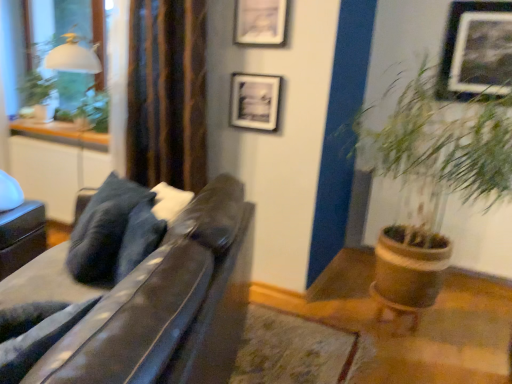
Question: Considering the relative sizes of matte black picture frame at upper center, which appears as the second picture frame when viewed from the left, and green leafy plant at right in the image provided, is matte black picture frame at upper center, which appears as the second picture frame when viewed from the left, bigger than green leafy plant at right?

Choices:
 (A) no
 (B) yes

Answer: (A)

Question: From the image's perspective, does matte black picture frame at upper center, marked as the 2th picture frame in a right-to-left arrangement, appear lower than green leafy plant at right?

Choices:
 (A) no
 (B) yes

Answer: (A)

Question: Is matte black picture frame at upper center, which appears as the second picture frame when viewed from the left, placed right next to green leafy plant at right?

Choices:
 (A) no
 (B) yes

Answer: (A)

Question: Considering the relative sizes of matte black picture frame at upper center, which appears as the second picture frame when viewed from the left, and green leafy plant at right in the image provided, is matte black picture frame at upper center, which appears as the second picture frame when viewed from the left, thinner than green leafy plant at right?

Choices:
 (A) yes
 (B) no

Answer: (A)

Question: Is matte black picture frame at upper center, which appears as the second picture frame when viewed from the left, facing away from green leafy plant at right?

Choices:
 (A) no
 (B) yes

Answer: (A)

Question: Considering the positions of matte black picture frame at upper center, marked as the 2th picture frame in a right-to-left arrangement, and green leafy plant at upper left in the image, is matte black picture frame at upper center, marked as the 2th picture frame in a right-to-left arrangement, bigger or smaller than green leafy plant at upper left?

Choices:
 (A) small
 (B) big

Answer: (A)

Question: Is point (260, 29) positioned closer to the camera than point (76, 119)?

Choices:
 (A) closer
 (B) farther

Answer: (A)

Question: Choose the correct answer: Is matte black picture frame at upper center, which appears as the second picture frame when viewed from the left, inside green leafy plant at upper left or outside it?

Choices:
 (A) inside
 (B) outside

Answer: (B)

Question: Is matte black picture frame at upper center, which appears as the second picture frame when viewed from the left, in front of or behind green leafy plant at upper left in the image?

Choices:
 (A) front
 (B) behind

Answer: (A)

Question: Relative to dark blue fabric pillow at center, is matte black picture frame at upper center, which is the 3th picture frame from right to left, in front or behind?

Choices:
 (A) behind
 (B) front

Answer: (A)

Question: Considering the relative positions of matte black picture frame at upper center, which is the 3th picture frame from right to left, and dark blue fabric pillow at center in the image provided, is matte black picture frame at upper center, which is the 3th picture frame from right to left, to the left or to the right of dark blue fabric pillow at center?

Choices:
 (A) left
 (B) right

Answer: (B)

Question: Which is correct: matte black picture frame at upper center, placed as the first picture frame when sorted from left to right, is inside dark blue fabric pillow at center, or outside of it?

Choices:
 (A) outside
 (B) inside

Answer: (A)

Question: Is point (271, 109) closer or farther from the camera than point (122, 200)?

Choices:
 (A) closer
 (B) farther

Answer: (B)

Question: From the image's perspective, is metallic silver picture frame at upper right, which is the third picture frame in left-to-right order, above or below matte black swivel chair at left?

Choices:
 (A) above
 (B) below

Answer: (A)

Question: From their relative heights in the image, would you say metallic silver picture frame at upper right, which is the third picture frame in left-to-right order, is taller or shorter than matte black swivel chair at left?

Choices:
 (A) tall
 (B) short

Answer: (A)